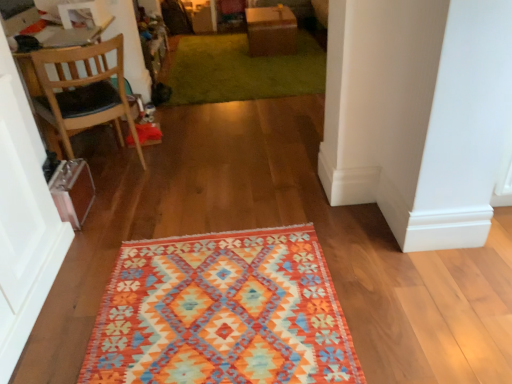
The width and height of the screenshot is (512, 384). Identify the location of vacant space to the left of brown cardboard box at upper center. (214, 47).